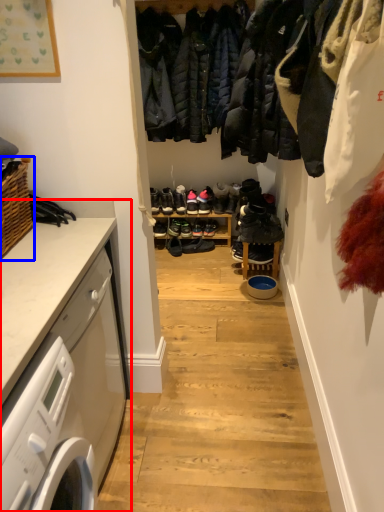
Question: Among these objects, which one is nearest to the camera, countertop (highlighted by a red box) or basket (highlighted by a blue box)?

Choices:
 (A) countertop
 (B) basket

Answer: (A)